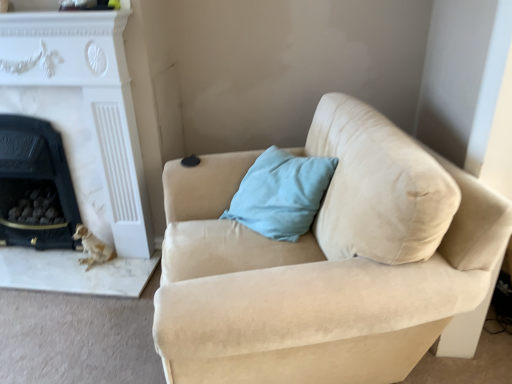
Question: Considering the relative sizes of beige suede couch at center and black marble fireplace at left, the 2th fireplace viewed from the right, in the image provided, is beige suede couch at center smaller than black marble fireplace at left, the 2th fireplace viewed from the right,?

Choices:
 (A) yes
 (B) no

Answer: (B)

Question: From the image's perspective, does beige suede couch at center appear higher than black marble fireplace at left, the 2th fireplace viewed from the right?

Choices:
 (A) no
 (B) yes

Answer: (A)

Question: From a real-world perspective, is beige suede couch at center positioned over black marble fireplace at left, the 2th fireplace viewed from the right, based on gravity?

Choices:
 (A) no
 (B) yes

Answer: (B)

Question: Does beige suede couch at center touch black marble fireplace at left, the 2th fireplace viewed from the right?

Choices:
 (A) yes
 (B) no

Answer: (B)

Question: Is beige suede couch at center completely or partially outside of black marble fireplace at left, the 2th fireplace viewed from the right?

Choices:
 (A) no
 (B) yes

Answer: (B)

Question: From the image's perspective, relative to beige suede couch at center, is black marble fireplace at left, which appears as the 1th fireplace when viewed from the left, above or below?

Choices:
 (A) below
 (B) above

Answer: (B)

Question: Considering the positions of black marble fireplace at left, the 2th fireplace viewed from the right, and beige suede couch at center in the image, is black marble fireplace at left, the 2th fireplace viewed from the right, wider or thinner than beige suede couch at center?

Choices:
 (A) thin
 (B) wide

Answer: (A)

Question: Relative to beige suede couch at center, is black marble fireplace at left, which appears as the 1th fireplace when viewed from the left, in front or behind?

Choices:
 (A) front
 (B) behind

Answer: (B)

Question: In the image, is black marble fireplace at left, which appears as the 1th fireplace when viewed from the left, on the left side or the right side of beige suede couch at center?

Choices:
 (A) right
 (B) left

Answer: (B)

Question: Relative to white marble fireplace at left, marked as the second fireplace in a left-to-right arrangement, is beige suede couch at center in front or behind?

Choices:
 (A) behind
 (B) front

Answer: (B)

Question: Is beige suede couch at center wider or thinner than white marble fireplace at left, which is counted as the first fireplace, starting from the right?

Choices:
 (A) wide
 (B) thin

Answer: (A)

Question: Would you say beige suede couch at center is inside or outside white marble fireplace at left, which is counted as the first fireplace, starting from the right?

Choices:
 (A) outside
 (B) inside

Answer: (A)

Question: From a real-world perspective, relative to white marble fireplace at left, marked as the second fireplace in a left-to-right arrangement, is beige suede couch at center vertically above or below?

Choices:
 (A) below
 (B) above

Answer: (A)

Question: Is black marble fireplace at left, which appears as the 1th fireplace when viewed from the left, inside the boundaries of white marble fireplace at left, marked as the second fireplace in a left-to-right arrangement, or outside?

Choices:
 (A) outside
 (B) inside

Answer: (B)

Question: Considering the positions of black marble fireplace at left, which appears as the 1th fireplace when viewed from the left, and white marble fireplace at left, marked as the second fireplace in a left-to-right arrangement, in the image, is black marble fireplace at left, which appears as the 1th fireplace when viewed from the left, bigger or smaller than white marble fireplace at left, marked as the second fireplace in a left-to-right arrangement,?

Choices:
 (A) small
 (B) big

Answer: (A)